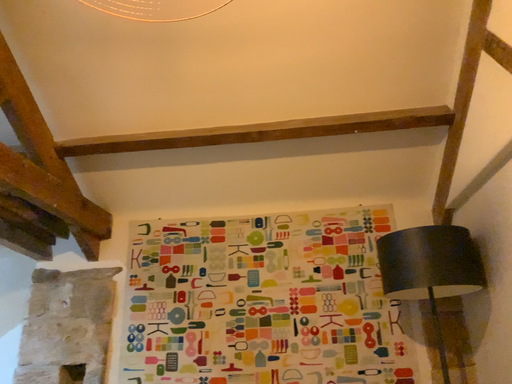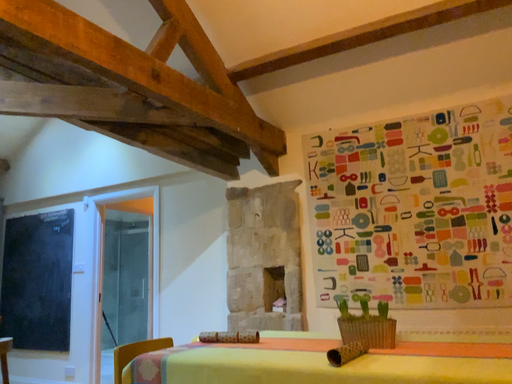
Question: Which way did the camera rotate in the video?

Choices:
 (A) rotated downward
 (B) rotated upward

Answer: (A)